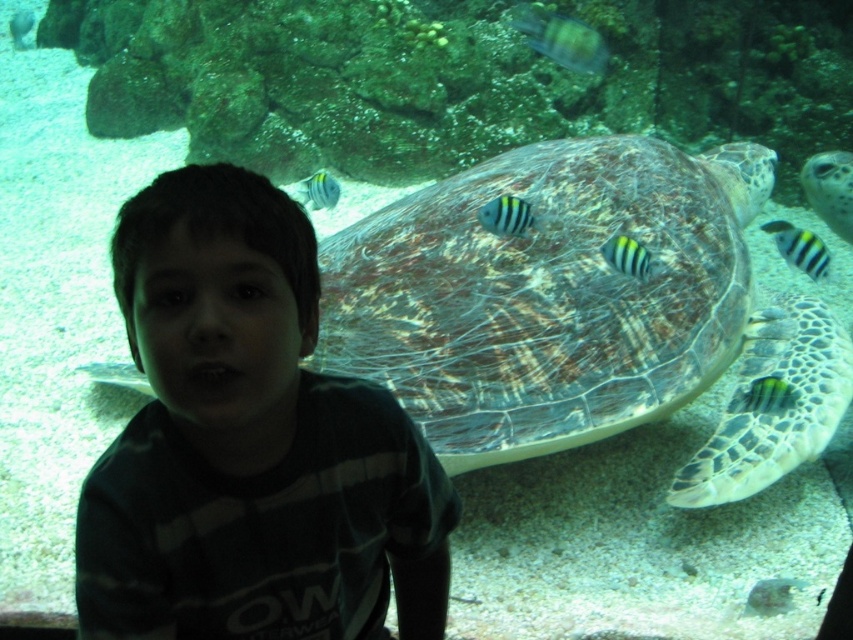
Question: Is blue striped fish at upper center positioned in front of smooth greenish-blue fish at upper center?

Choices:
 (A) no
 (B) yes

Answer: (B)

Question: Which point is farther from the camera taking this photo?

Choices:
 (A) (811, 240)
 (B) (514, 225)
 (C) (18, 10)

Answer: (C)

Question: Is green striped fish at upper center bigger than smooth greenish-blue fish at upper center?

Choices:
 (A) yes
 (B) no

Answer: (A)

Question: Is yellow-black striped fish at center thinner than smooth greenish-blue fish at upper center?

Choices:
 (A) yes
 (B) no

Answer: (A)

Question: Based on their relative distances, which object is farther from the blue striped fish at upper center?

Choices:
 (A) leathery green turtle at center
 (B) green striped fish at upper center
 (C) yellow-black striped fish at center
 (D) striped fabric fish at center

Answer: (C)

Question: Which point appears closest to the camera in this image?

Choices:
 (A) (805, 248)
 (B) (523, 392)

Answer: (B)